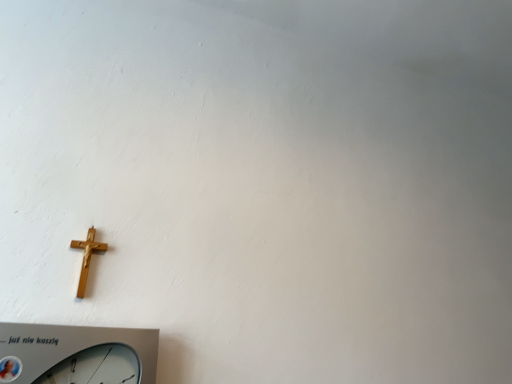
Find the location of `gold wooden crucifix at lower left`. gold wooden crucifix at lower left is located at coordinates (87, 257).

The height and width of the screenshot is (384, 512). Describe the element at coordinates (87, 257) in the screenshot. I see `gold wooden crucifix at lower left` at that location.

The image size is (512, 384). What are the coordinates of `silver metallic wall clock at lower left` in the screenshot? It's located at (77, 354).

This screenshot has width=512, height=384. What do you see at coordinates (77, 354) in the screenshot?
I see `silver metallic wall clock at lower left` at bounding box center [77, 354].

Measure the distance between point [54,349] and camera.

The distance of point [54,349] from camera is 64.50 centimeters.

Identify the location of gold wooden crucifix at lower left. (87, 257).

Which is more to the right, silver metallic wall clock at lower left or gold wooden crucifix at lower left?

Positioned to the right is silver metallic wall clock at lower left.

Considering their positions, is silver metallic wall clock at lower left located in front of or behind gold wooden crucifix at lower left?

Result: silver metallic wall clock at lower left is in front of gold wooden crucifix at lower left.

Is point (91, 377) positioned before point (82, 277)?

Yes, it is in front of point (82, 277).

From the image's perspective, between silver metallic wall clock at lower left and gold wooden crucifix at lower left, which one is located above?

gold wooden crucifix at lower left.

From a real-world perspective, is silver metallic wall clock at lower left positioned above or below gold wooden crucifix at lower left?

From a real-world perspective, silver metallic wall clock at lower left is physically below gold wooden crucifix at lower left.

Is silver metallic wall clock at lower left thinner than gold wooden crucifix at lower left?

Incorrect, the width of silver metallic wall clock at lower left is not less than that of gold wooden crucifix at lower left.

Considering the sizes of silver metallic wall clock at lower left and gold wooden crucifix at lower left in the image, is silver metallic wall clock at lower left taller or shorter than gold wooden crucifix at lower left?

In the image, silver metallic wall clock at lower left appears to be taller than gold wooden crucifix at lower left.

Considering the relative sizes of silver metallic wall clock at lower left and gold wooden crucifix at lower left in the image provided, is silver metallic wall clock at lower left smaller than gold wooden crucifix at lower left?

Incorrect, silver metallic wall clock at lower left is not smaller in size than gold wooden crucifix at lower left.

Is silver metallic wall clock at lower left not inside gold wooden crucifix at lower left?

silver metallic wall clock at lower left is positioned outside gold wooden crucifix at lower left.

Are silver metallic wall clock at lower left and gold wooden crucifix at lower left located far from each other?

Actually, silver metallic wall clock at lower left and gold wooden crucifix at lower left are a little close together.

Could you tell me if silver metallic wall clock at lower left is facing gold wooden crucifix at lower left?

No, silver metallic wall clock at lower left does not turn towards gold wooden crucifix at lower left.

Can you tell me how much silver metallic wall clock at lower left and gold wooden crucifix at lower left differ in facing direction?

The facing directions of silver metallic wall clock at lower left and gold wooden crucifix at lower left are 1.11 degrees apart.

You are a GUI agent. You are given a task and a screenshot of the screen. Output one action in this format:
    pyautogui.click(x=<x>, y=<y>)
    Task: Click on the wall clock on the right of gold wooden crucifix at lower left
    This screenshot has width=512, height=384.
    Given the screenshot: What is the action you would take?
    pyautogui.click(x=77, y=354)

Between gold wooden crucifix at lower left and silver metallic wall clock at lower left, which one appears on the right side from the viewer's perspective?

Positioned to the right is silver metallic wall clock at lower left.

In the scene shown: Is the depth of gold wooden crucifix at lower left less than that of silver metallic wall clock at lower left?

No, gold wooden crucifix at lower left is further to the viewer.

Which is in front, point (82, 271) or point (69, 338)?

The point (69, 338) is closer to the camera.

From the image's perspective, is gold wooden crucifix at lower left positioned above or below silver metallic wall clock at lower left?

gold wooden crucifix at lower left is situated higher than silver metallic wall clock at lower left in the image.

From a real-world perspective, relative to silver metallic wall clock at lower left, is gold wooden crucifix at lower left vertically above or below?

In terms of real-world spatial position, gold wooden crucifix at lower left is above silver metallic wall clock at lower left.

Considering the sizes of objects gold wooden crucifix at lower left and silver metallic wall clock at lower left in the image provided, who is wider, gold wooden crucifix at lower left or silver metallic wall clock at lower left?

With larger width is silver metallic wall clock at lower left.

Which of these two, gold wooden crucifix at lower left or silver metallic wall clock at lower left, stands taller?

Standing taller between the two is silver metallic wall clock at lower left.

Considering the sizes of objects gold wooden crucifix at lower left and silver metallic wall clock at lower left in the image provided, who is smaller, gold wooden crucifix at lower left or silver metallic wall clock at lower left?

With smaller size is gold wooden crucifix at lower left.

Can we say gold wooden crucifix at lower left lies outside silver metallic wall clock at lower left?

Yes, gold wooden crucifix at lower left is located beyond the bounds of silver metallic wall clock at lower left.

Would you say gold wooden crucifix at lower left is a long distance from silver metallic wall clock at lower left?

Actually, gold wooden crucifix at lower left and silver metallic wall clock at lower left are a little close together.

Could you tell me if gold wooden crucifix at lower left is turned towards silver metallic wall clock at lower left?

No, gold wooden crucifix at lower left is not turned towards silver metallic wall clock at lower left.

Can you tell me how much gold wooden crucifix at lower left and silver metallic wall clock at lower left differ in facing direction?

The facing directions of gold wooden crucifix at lower left and silver metallic wall clock at lower left are 1.11 degrees apart.

How far apart are gold wooden crucifix at lower left and silver metallic wall clock at lower left?

gold wooden crucifix at lower left is 12.17 centimeters away from silver metallic wall clock at lower left.

There is a silver metallic wall clock at lower left. Identify the location of crucifix above it (from a real-world perspective). (87, 257).

Locate an element on the screen. The image size is (512, 384). crucifix on the left side of silver metallic wall clock at lower left is located at coordinates (87, 257).

At what (x,y) coordinates should I click in order to perform the action: click on wall clock in front of the gold wooden crucifix at lower left. Please return your answer as a coordinate pair (x, y). Image resolution: width=512 pixels, height=384 pixels. Looking at the image, I should click on (77, 354).